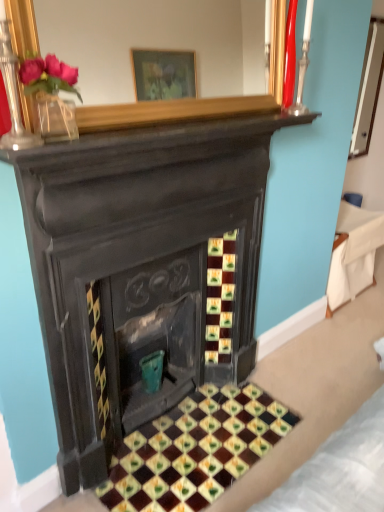
Question: Choose the correct answer: Is teal ceramic vase at center inside white fabric at right or outside it?

Choices:
 (A) inside
 (B) outside

Answer: (B)

Question: In the image, is teal ceramic vase at center positioned in front of or behind white fabric at right?

Choices:
 (A) behind
 (B) front

Answer: (B)

Question: Which of these objects is positioned farthest from the white fabric at right?

Choices:
 (A) glazed ceramic tiles at center
 (B) teal ceramic vase at center

Answer: (B)

Question: Which object is positioned farthest from the teal ceramic vase at center?

Choices:
 (A) white fabric at right
 (B) glazed ceramic tiles at center

Answer: (A)